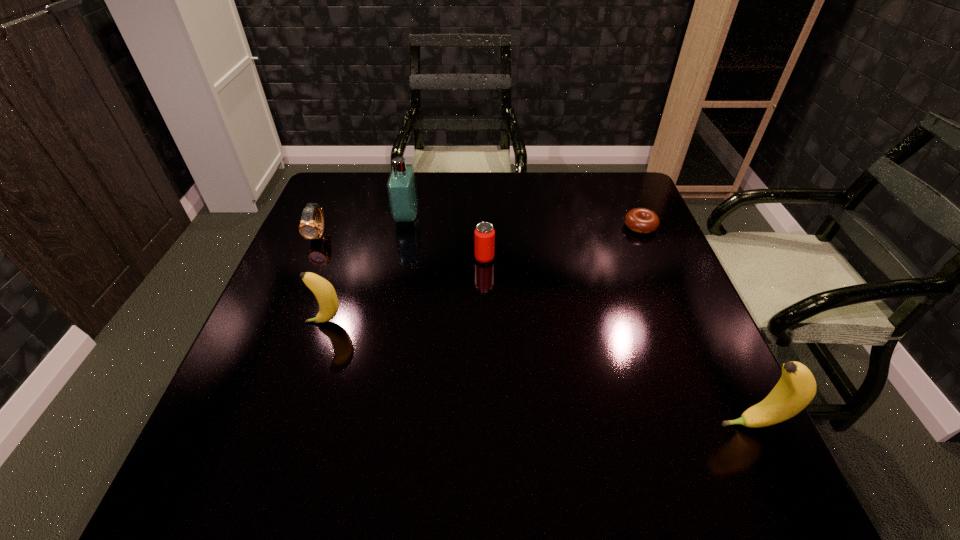
Locate an element on the screen. the fifth object from right to left is located at coordinates (323, 290).

What are the coordinates of `the fourth shortest object` in the screenshot? It's located at (323, 290).

The height and width of the screenshot is (540, 960). I want to click on the right banana, so 796,388.

Locate an element on the screen. the taller banana is located at coordinates (796, 388).

The width and height of the screenshot is (960, 540). In order to click on doughnut in this screenshot , I will do `click(641, 220)`.

Find the location of `watch`. watch is located at coordinates (309, 229).

The image size is (960, 540). What are the coordinates of `the third object from left to right` in the screenshot? It's located at (402, 192).

This screenshot has height=540, width=960. I want to click on the third nearest object, so click(484, 233).

Find the location of a particular element. the fourth object from left to right is located at coordinates (484, 233).

Identify the location of vacant region located 0.080m from the stem of the left banana. (270, 322).